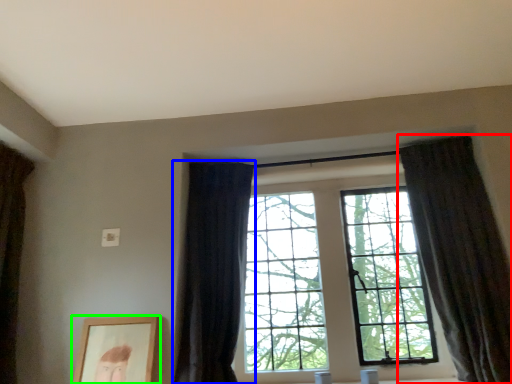
Question: Considering the real-world distances, which object is farthest from curtain (highlighted by a red box)? curtain (highlighted by a blue box) or picture frame (highlighted by a green box)?

Choices:
 (A) curtain
 (B) picture frame

Answer: (B)